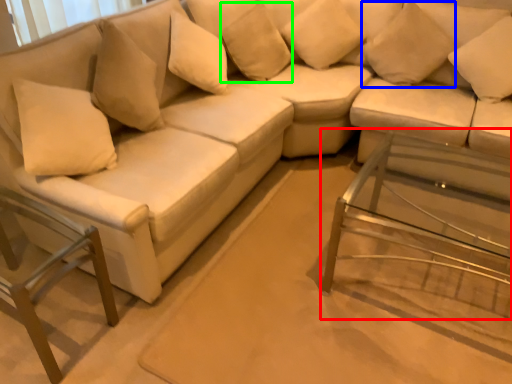
Question: Which object is positioned farthest from side table (highlighted by a red box)? Select from pillow (highlighted by a blue box) and pillow (highlighted by a green box).

Choices:
 (A) pillow
 (B) pillow

Answer: (B)